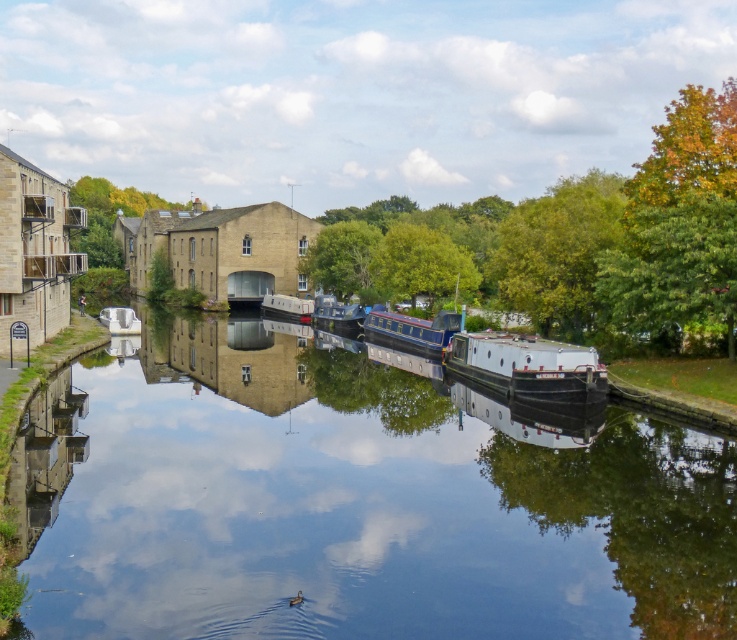
You are standing at the point with coordinates 0.5, 0.5 in the image. Which object from the list is closest to your current position? The options are metallic blue boat at center.

The metallic blue boat at center is located at point (338, 314), which is very close to your position at (368, 320). Therefore, the metallic blue boat at center is the closest object to your current position.

You are standing on the left bank of the canal and want to throw a pebble to hit the metallic blue boat at center. Is the distance feasible for an average adult?

The metallic blue boat at center is 58.02 meters away from the viewer. An average adult can throw a pebble about 20 to 30 meters, so it is not feasible to hit the metallic blue boat at center from this distance.

You are a delivery person needing to pass between the metallic blue boat at center and the white glossy canal boat at center with your 2.5 meter wide delivery cart. Can your cart fit through the space between them?

The metallic blue boat at center is thinner than the white glossy canal boat at center, but without knowing the exact width of the space between them, it is impossible to determine if the 2.5 meter wide delivery cart can fit through.